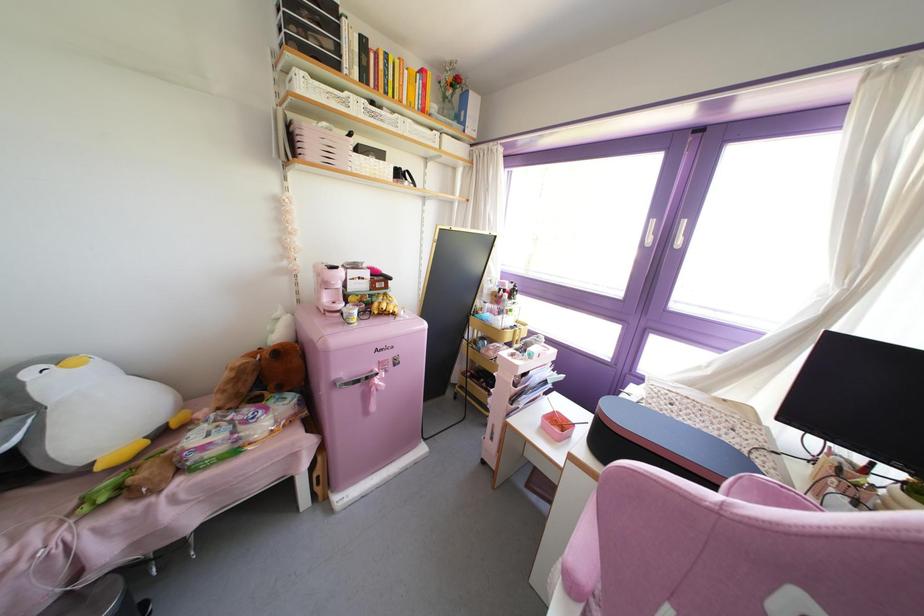
Which object does [253,423] point to?

It refers to a toilet paper package.